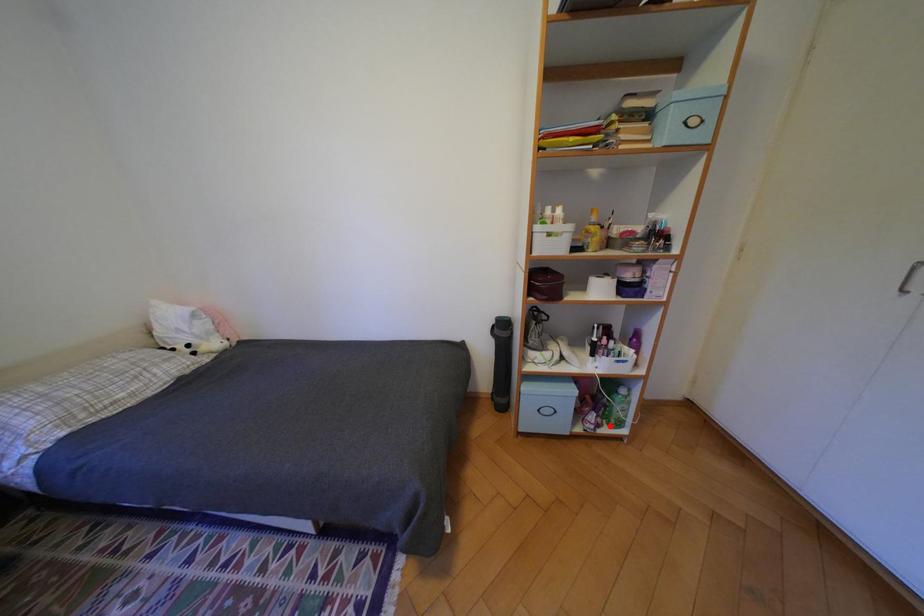
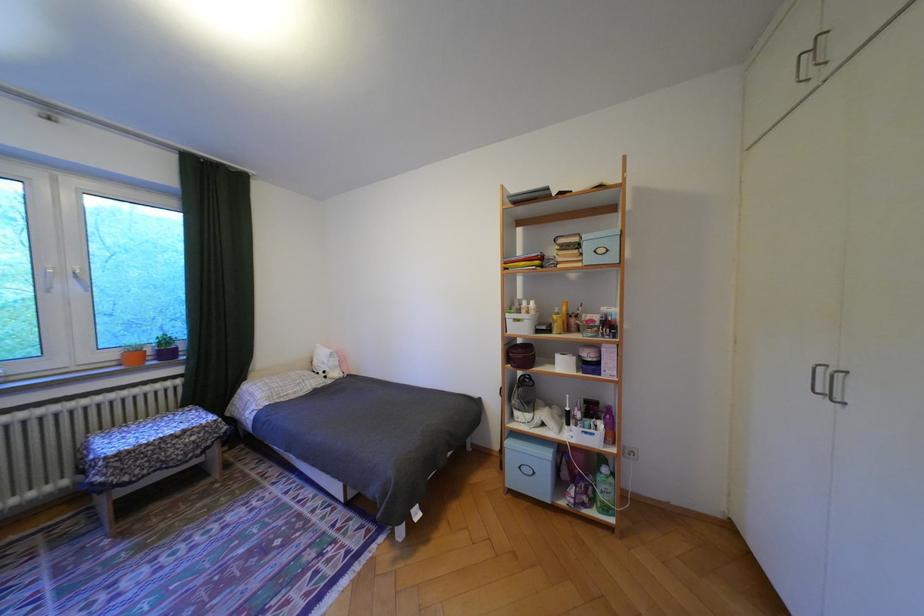
Question: I am providing you with two images of the same scene from different viewpoints. A red point is shown in image1. For the corresponding object point in image2, is it positioned nearer or farther from the camera?

Choices:
 (A) Nearer
 (B) Farther

Answer: (A)